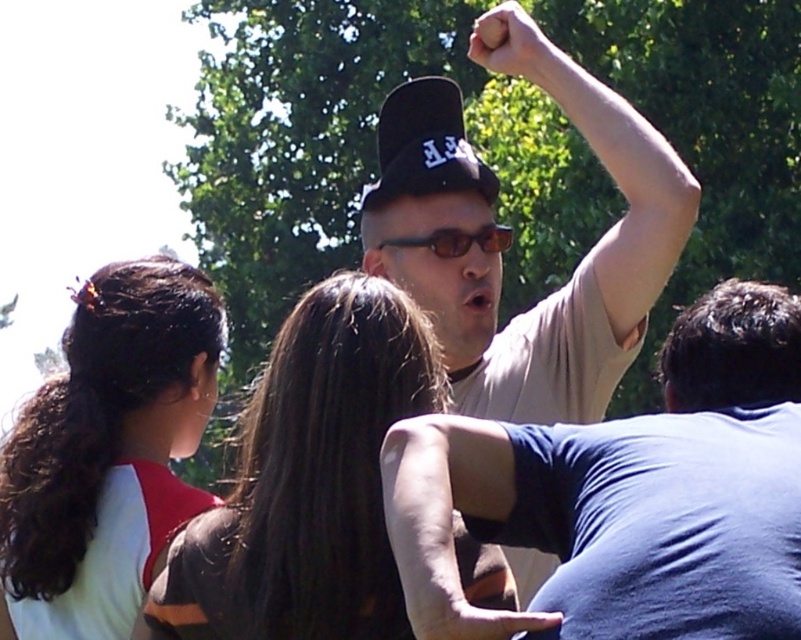
Between point (222, 579) and point (457, 154), which one is positioned behind?

Positioned behind is point (457, 154).

Can you confirm if dark brown hair at center is positioned above black matte baseball cap at center?

No, dark brown hair at center is not above black matte baseball cap at center.

Between point (393, 330) and point (451, 132), which one is positioned in front?

Point (393, 330)

You are a GUI agent. You are given a task and a screenshot of the screen. Output one action in this format:
    pyautogui.click(x=<x>, y=<y>)
    Task: Click on the dark brown hair at center
    The image size is (801, 640).
    Given the screenshot: What is the action you would take?
    pyautogui.click(x=308, y=481)

Which is more to the left, matte beige shirt at center or smooth skin hand at upper center?

From the viewer's perspective, smooth skin hand at upper center appears more on the left side.

Describe the element at coordinates (501, 252) in the screenshot. I see `matte beige shirt at center` at that location.

Locate an element on the screen. Image resolution: width=801 pixels, height=640 pixels. matte beige shirt at center is located at coordinates (501, 252).

Is point (433, 81) closer to viewer compared to point (541, 44)?

No, it is not.

This screenshot has width=801, height=640. Describe the element at coordinates (425, 145) in the screenshot. I see `black matte baseball cap at center` at that location.

Image resolution: width=801 pixels, height=640 pixels. I want to click on black matte baseball cap at center, so click(x=425, y=145).